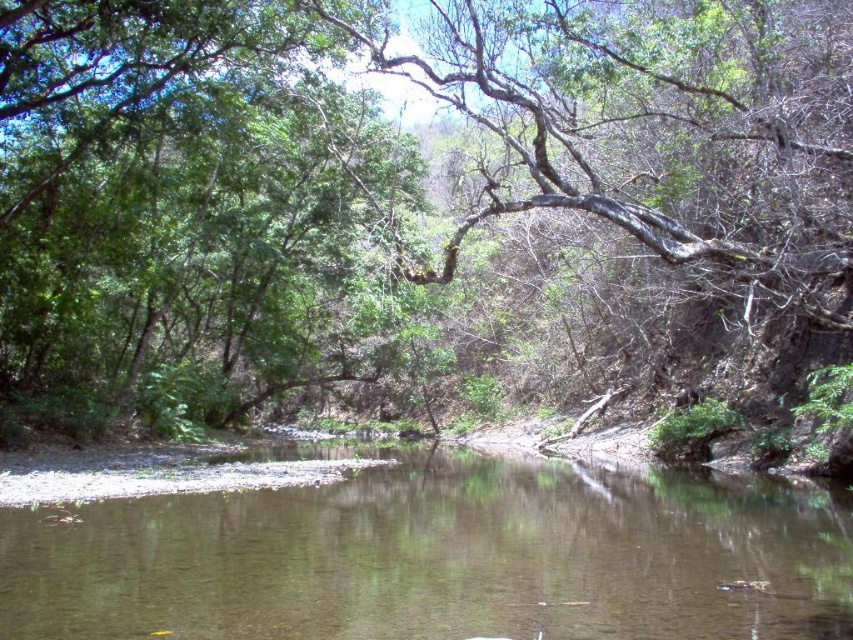
Can you confirm if green leafy tree at center is positioned to the left of brown/reflective water at center?

Indeed, green leafy tree at center is positioned on the left side of brown/reflective water at center.

Does green leafy tree at center appear on the right side of brown/reflective water at center?

In fact, green leafy tree at center is to the left of brown/reflective water at center.

Is point (12, 76) positioned before point (201, 524)?

No, it is behind (201, 524).

The image size is (853, 640). Identify the location of green leafy tree at center. (409, 195).